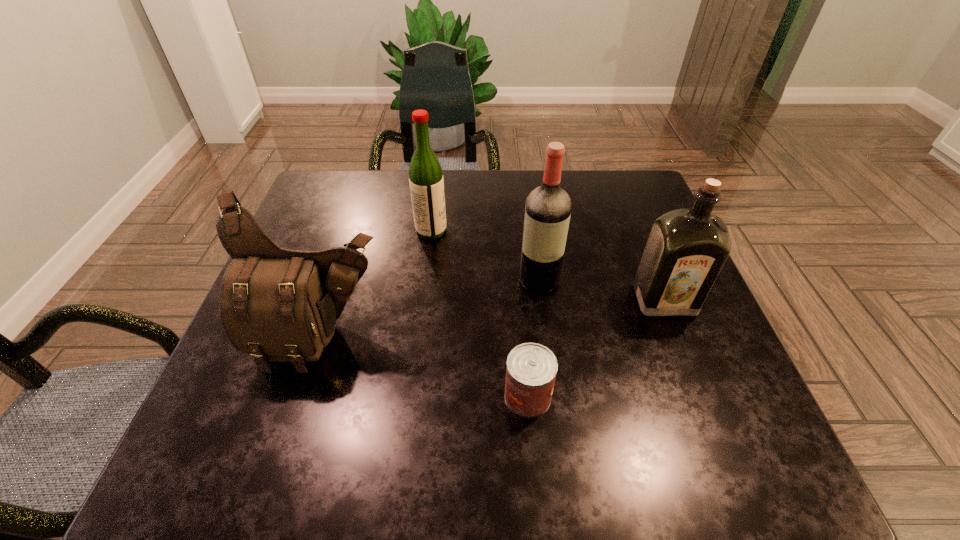
Identify which object is the third nearest to the shortest object. Please provide its 2D coordinates. Your answer should be formatted as a tuple, i.e. [(x, y)], where the tuple contains the x and y coordinates of a point satisfying the conditions above.

[(686, 248)]

Select which object appears as the second closest to the second liquor from right to left. Please provide its 2D coordinates. Your answer should be formatted as a tuple, i.e. [(x, y)], where the tuple contains the x and y coordinates of a point satisfying the conditions above.

[(426, 181)]

Image resolution: width=960 pixels, height=540 pixels. I want to click on liquor that stands as the second closest to the leftmost object, so click(x=548, y=208).

Image resolution: width=960 pixels, height=540 pixels. What are the coordinates of `liquor that can be found as the third closest to the shoulder bag` in the screenshot? It's located at (686, 248).

Find the location of `vacant point that satisfies the following two spatial constraints: 1. on the label of the farthest liquor; 2. on the front-facing side of the shoulder bag`. vacant point that satisfies the following two spatial constraints: 1. on the label of the farthest liquor; 2. on the front-facing side of the shoulder bag is located at coordinates (418, 339).

Where is `vacant space that satisfies the following two spatial constraints: 1. on the back side of the can; 2. on the label of the fourth object from right to left`? This screenshot has width=960, height=540. vacant space that satisfies the following two spatial constraints: 1. on the back side of the can; 2. on the label of the fourth object from right to left is located at coordinates (514, 231).

The width and height of the screenshot is (960, 540). Identify the location of free space that satisfies the following two spatial constraints: 1. on the front-facing side of the shoulder bag; 2. on the left side of the shortest object. click(303, 396).

Identify the location of vacant region that satisfies the following two spatial constraints: 1. on the front-facing side of the can; 2. on the right side of the shoulder bag. (303, 396).